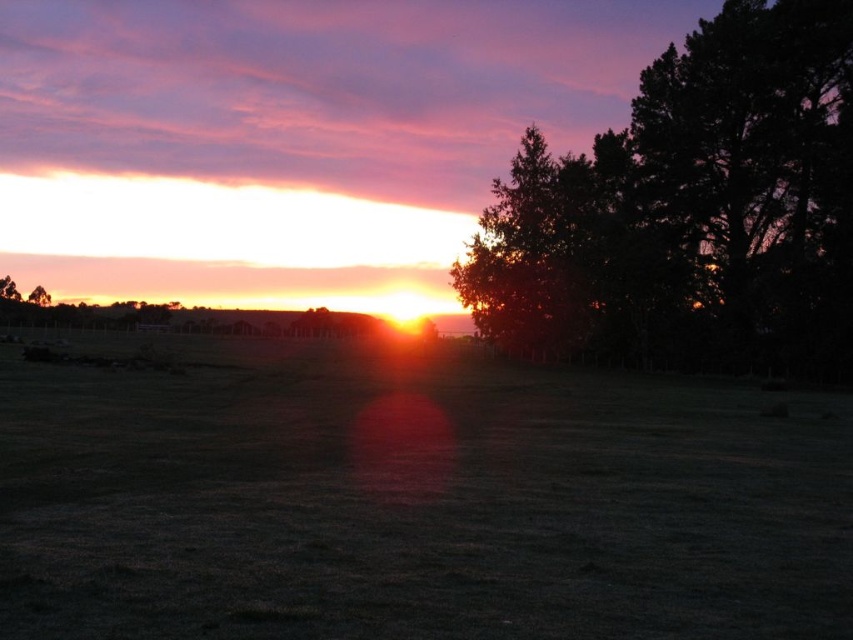
Can you confirm if dark green leafy tree at right is positioned to the right of green leafy tree at left?

Indeed, dark green leafy tree at right is positioned on the right side of green leafy tree at left.

What do you see at coordinates (689, 211) in the screenshot? I see `dark green leafy tree at right` at bounding box center [689, 211].

Locate an element on the screen. This screenshot has height=640, width=853. dark green leafy tree at right is located at coordinates (689, 211).

Does green leafy tree at left have a lesser width compared to green matte tree at left?

No.

Does green leafy tree at left appear over green matte tree at left?

Correct, green leafy tree at left is located above green matte tree at left.

Who is more distant from viewer, (15, 296) or (38, 291)?

The point (38, 291) is behind.

Locate an element on the screen. This screenshot has width=853, height=640. green leafy tree at left is located at coordinates (9, 289).

Based on the photo, who is positioned more to the right, brown grassy field at center or green matte tree at left?

From the viewer's perspective, brown grassy field at center appears more on the right side.

Between point (138, 592) and point (45, 304), which one is positioned in front?

Point (138, 592)

Which is in front, point (219, 470) or point (42, 294)?

Point (219, 470) is in front.

This screenshot has width=853, height=640. I want to click on brown grassy field at center, so click(412, 500).